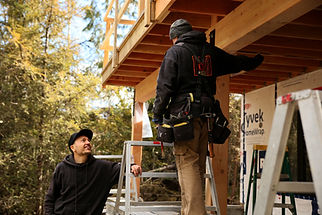
Locate an element on the screen. This screenshot has height=215, width=322. ladders is located at coordinates (144, 143), (305, 107).